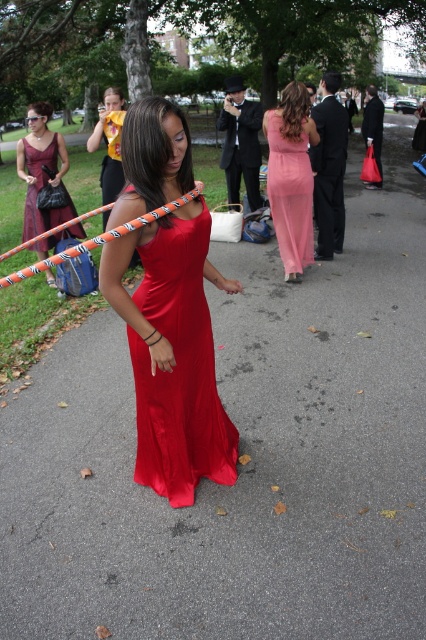
You are a photographer at a formal event. You need to decide which dress will be easier to photograph in low light because it reflects more light. Based on the description of the satin dress at center and the matte burgundy dress at center, which dress should you choose?

The satin dress at center is thinner than the matte burgundy dress at center, but the satin material typically reflects more light. Therefore, the satin dress at center would be easier to photograph in low light conditions.

You are a photographer at the event and want to capture a photo of both the satin dress at center and the matte burgundy dress at center. Which dress should you focus on first to ensure it fits well in the frame?

The satin dress at center is larger in size than the matte burgundy dress at center, so you should focus on the satin dress at center first to ensure it fits well in the frame.